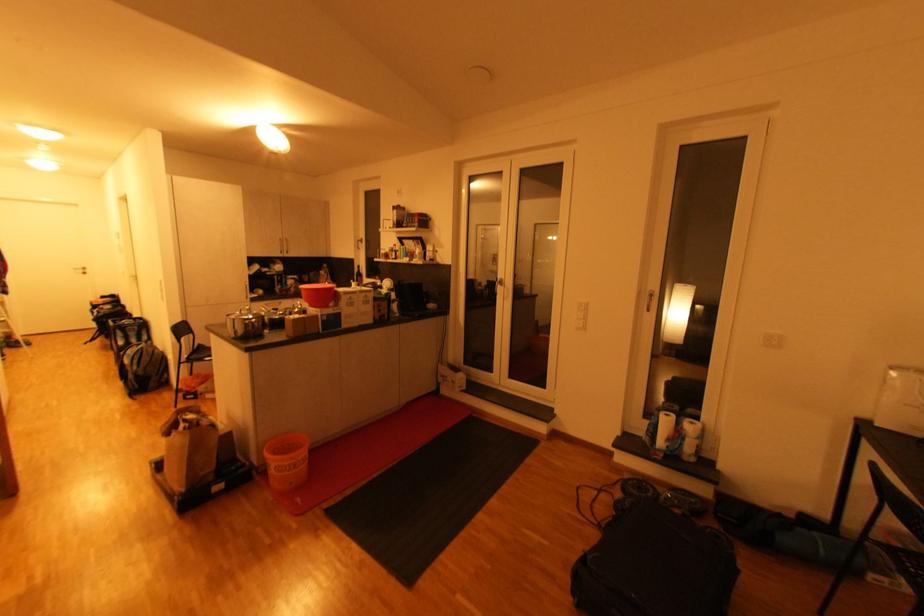
This screenshot has height=616, width=924. Describe the element at coordinates (681, 519) in the screenshot. I see `the black backpack handle` at that location.